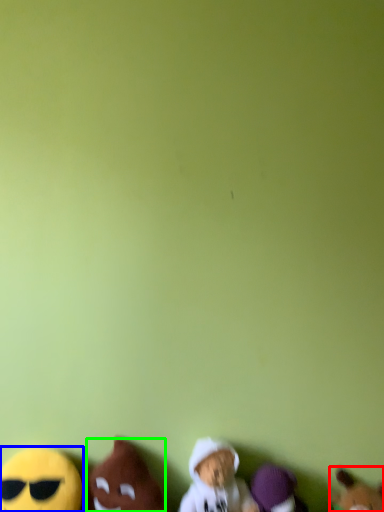
Question: Which object is the closest to the toy (highlighted by a red box)? Choose among these: toy (highlighted by a blue box) or toy (highlighted by a green box).

Choices:
 (A) toy
 (B) toy

Answer: (B)